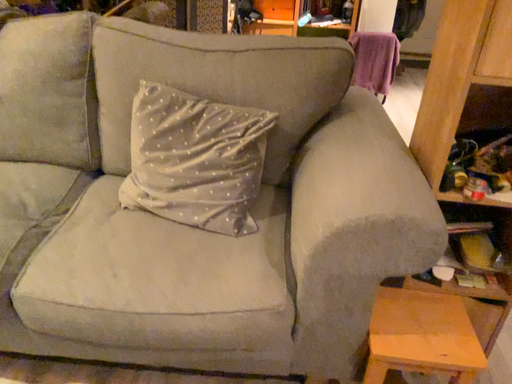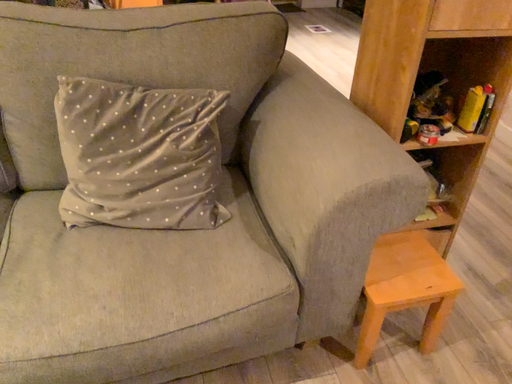
Question: How did the camera likely rotate when shooting the video?

Choices:
 (A) rotated left
 (B) rotated right

Answer: (B)